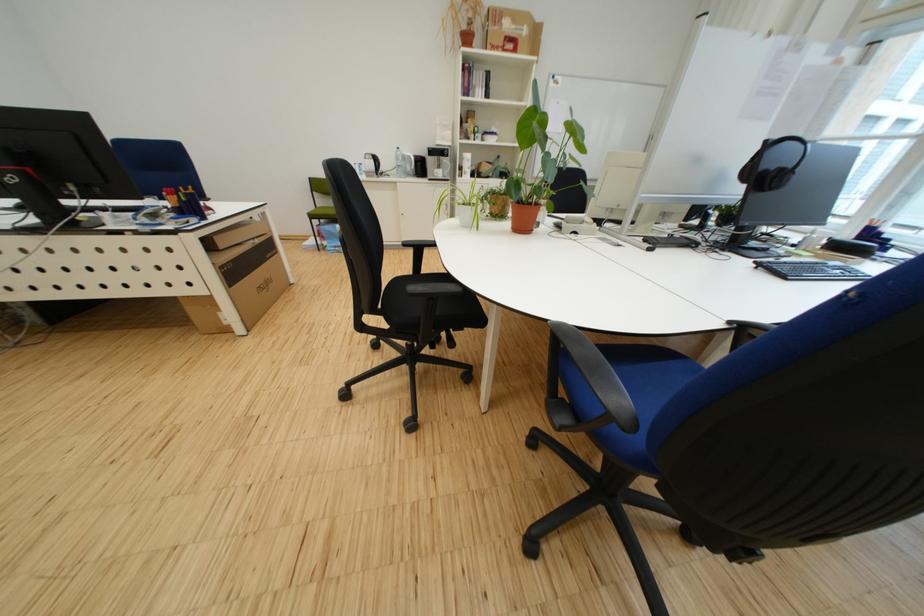
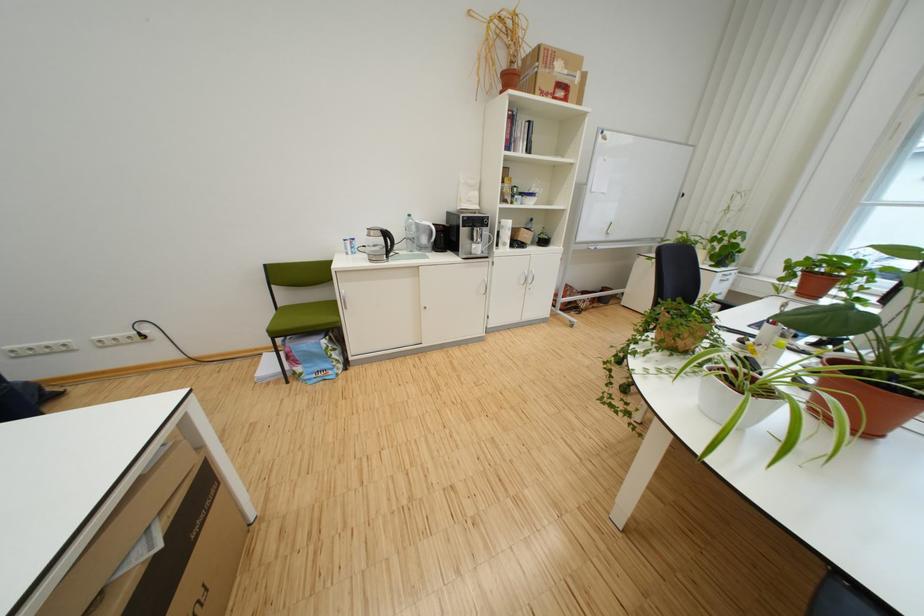
Locate, in the second image, the point that corresponds to the point at 505,50 in the first image.

(553, 95)